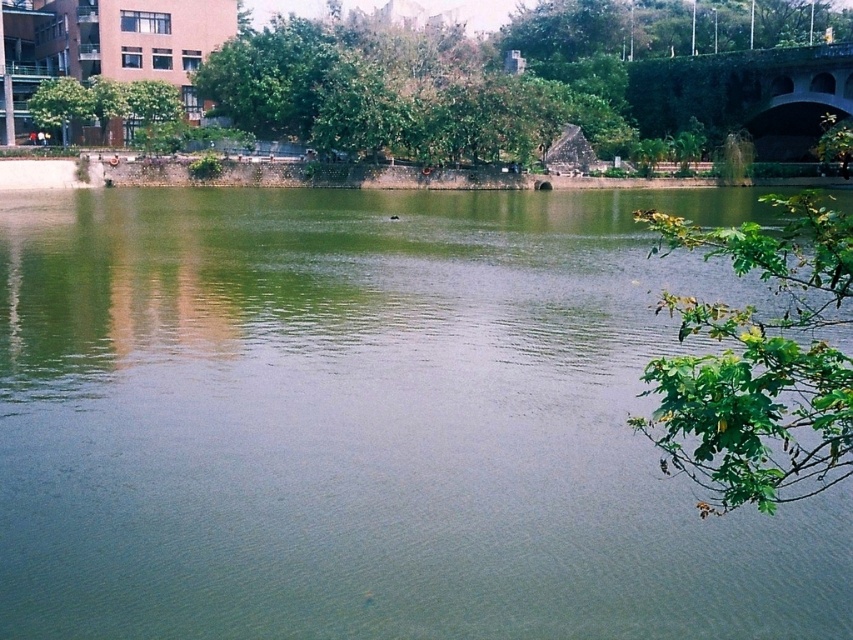
You are a photographer trying to capture the reflection of the green leafy tree at upper left in the green smooth water at center. Based on the scene description, will the tree be clearly visible in the water?

The green smooth water at center is positioned under the green leafy tree at upper left, so the tree is directly above the water. Since the water is smooth and still, the reflection of the green leafy tree at upper left should be clearly visible in the green smooth water at center.

You are standing at the camera position and want to reach the point at coordinates (717, 356). Given that your maximum walking distance is 25 feet, can you reach it without exceeding your limit?

The point at coordinates (717, 356) is 24.70 feet away from the camera, so yes, you can reach it within your 25 feet limit.

In the scene shown: You are a photographer planning to capture the reflection of the green concrete bridge at upper right and the green leafy tree at upper left in the water. Which object will have a larger reflection in the water?

The green concrete bridge at upper right has a larger size than the green leafy tree at upper left, so its reflection in the water will also be larger.